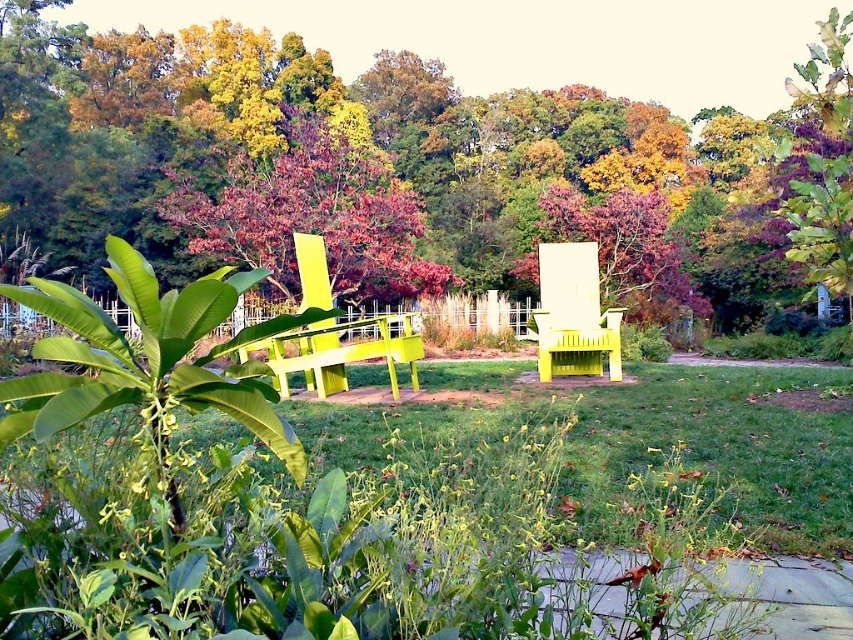
Question: Which is farther from the smooth yellow bench at center?

Choices:
 (A) green grass at center
 (B) green matte bench at center

Answer: (B)

Question: From the image, what is the correct spatial relationship of green matte bench at center in relation to smooth yellow bench at center?

Choices:
 (A) below
 (B) above

Answer: (B)

Question: Which of the following is the farthest from the observer?

Choices:
 (A) (363, 426)
 (B) (253, 344)
 (C) (207, 244)
 (D) (601, 348)

Answer: (C)

Question: Which point is closer to the camera?

Choices:
 (A) green matte bench at center
 (B) bright yellow plastic chair at center

Answer: (A)

Question: Is green matte bench at center further to camera compared to smooth yellow bench at center?

Choices:
 (A) yes
 (B) no

Answer: (B)

Question: Can you confirm if bright yellow plastic chair at center is positioned above yellow matte chair at center?

Choices:
 (A) no
 (B) yes

Answer: (B)